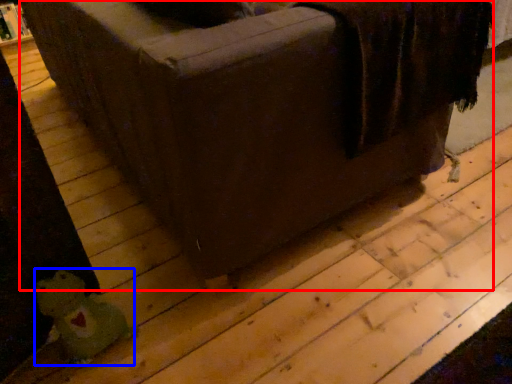
Question: Which of the following is the closest to the observer, furniture (highlighted by a red box) or toy (highlighted by a blue box)?

Choices:
 (A) furniture
 (B) toy

Answer: (A)